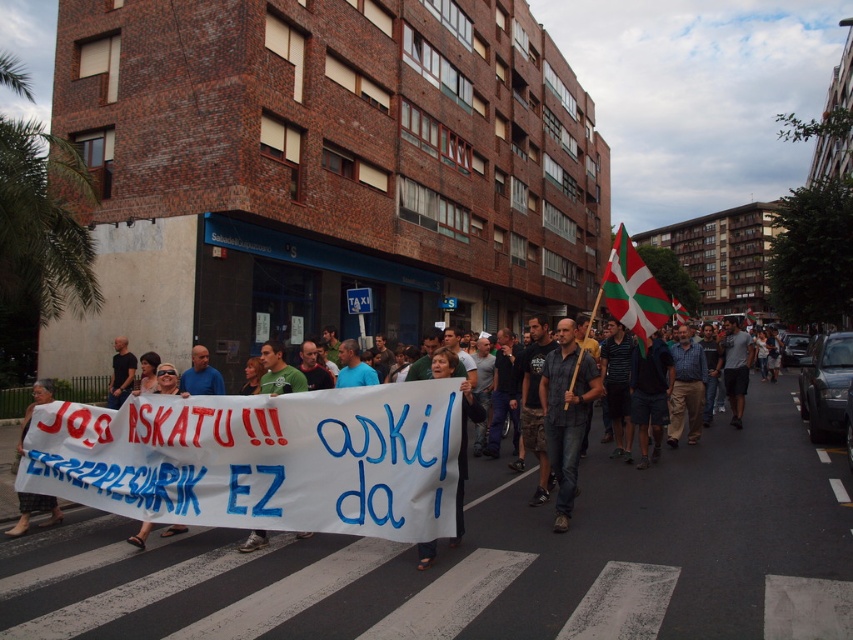
Question: Which object is farther from the camera taking this photo?

Choices:
 (A) denim jeans at center
 (B) white and red striped flag at center

Answer: (B)

Question: Which of the following is the farthest from the observer?

Choices:
 (A) denim jeans at center
 (B) white paper sign at center
 (C) white and red striped flag at center
 (D) white fabric banner at lower left

Answer: (C)

Question: Which point is closer to the camera?

Choices:
 (A) (753, 312)
 (B) (567, 481)

Answer: (B)

Question: Is white paper sign at center thinner than white fabric flag at center?

Choices:
 (A) yes
 (B) no

Answer: (A)

Question: Considering the relative positions of denim jeans at center and white paper sign at center in the image provided, where is denim jeans at center located with respect to white paper sign at center?

Choices:
 (A) left
 (B) right

Answer: (B)

Question: Is white paper sign at center further to the viewer compared to white fabric banner at lower left?

Choices:
 (A) no
 (B) yes

Answer: (A)